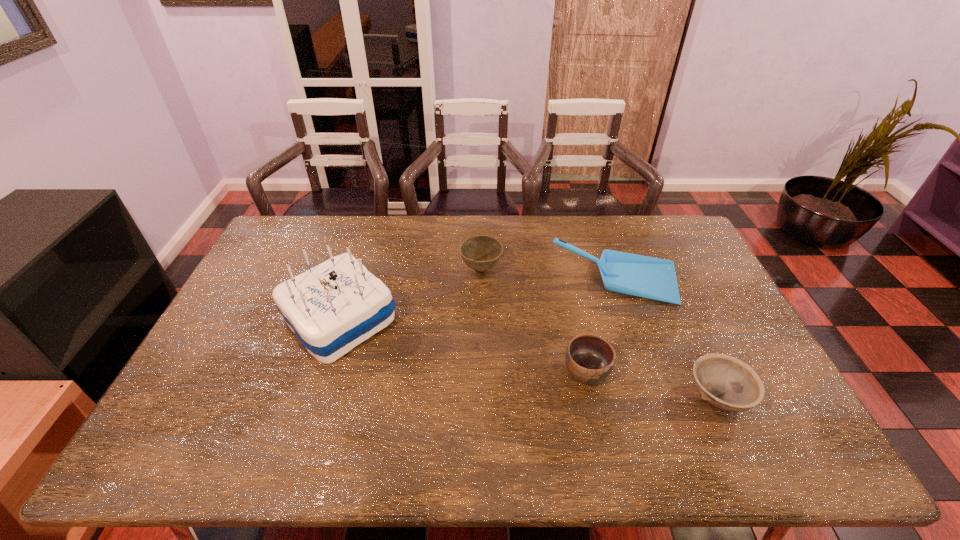
Locate which object ranks second in proximity to the dustpan. Please provide its 2D coordinates. Your answer should be formatted as a tuple, i.e. [(x, y)], where the tuple contains the x and y coordinates of a point satisfying the conditions above.

[(589, 358)]

This screenshot has width=960, height=540. I want to click on the second closest bowl to the second bowl from right to left, so 481,253.

Point out which bowl is positioned as the second nearest to the birthday cake. Please provide its 2D coordinates. Your answer should be formatted as a tuple, i.e. [(x, y)], where the tuple contains the x and y coordinates of a point satisfying the conditions above.

[(589, 358)]

Locate an element on the screen. vacant region that satisfies the following two spatial constraints: 1. on the front side of the second bowl from right to left; 2. on the right side of the birthday cake is located at coordinates (323, 372).

What are the coordinates of `vacant region that satisfies the following two spatial constraints: 1. on the front side of the birthday cake; 2. on the left side of the rightmost bowl` in the screenshot? It's located at (315, 397).